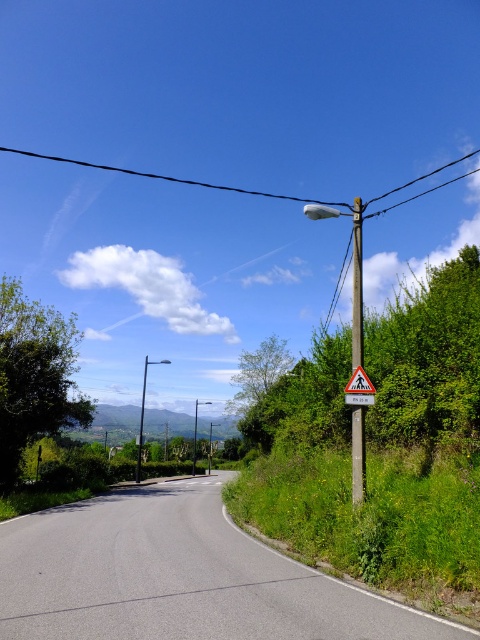
You are a pedestrian carrying a large box that is 10 feet wide. You need to walk from the road to the grassy verge on the right. Can you pass between the metallic gray pole at upper right and the yellow plastic pedestrian crossing sign at upper right without the box touching either?

The metallic gray pole at upper right is 9.47 feet away from the yellow plastic pedestrian crossing sign at upper right. Since your box is 10 feet wide, it would not fit between them as the distance is less than the box width.

You are a delivery driver approaching the rural road scene. You need to know if the black wire at upper center is positioned above the yellow plastic pedestrian crossing sign at upper right to avoid hitting it with your truck. Can you confirm this?

The black wire at upper center is indeed positioned above the yellow plastic pedestrian crossing sign at upper right, so you should be cautious to avoid hitting the wire with your truck.

You are a painter setting up your easel by the roadside. You want to paint the metallic gray pole at upper right and the black wire at upper center. Which object should you focus on first if you want to paint the taller one?

The black wire at upper center is taller than the metallic gray pole at upper right, so you should focus on painting the black wire at upper center first.